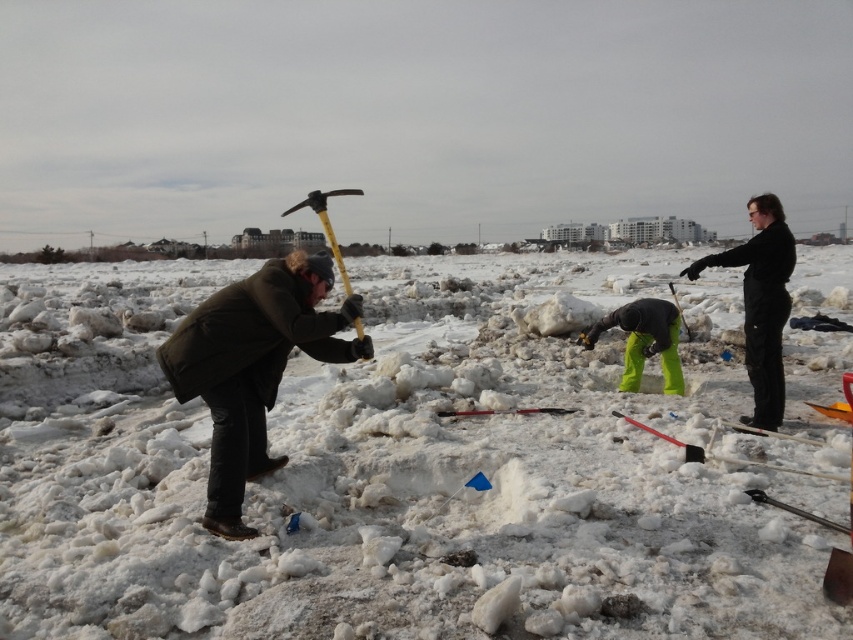
Question: Estimate the real-world distances between objects in this image. Which object is closer to the green fabric pants at center?

Choices:
 (A) black matte jacket at upper right
 (B) dark green jacket at left

Answer: (A)

Question: Does white fluffy snow at center have a lesser width compared to black matte jacket at upper right?

Choices:
 (A) yes
 (B) no

Answer: (B)

Question: In this image, where is dark green jacket at left located relative to green fabric pants at center?

Choices:
 (A) below
 (B) above

Answer: (A)

Question: Which point is closer to the camera taking this photo?

Choices:
 (A) click(627, 323)
 (B) click(782, 220)
 (C) click(216, 400)

Answer: (C)

Question: Which object is farther from the camera taking this photo?

Choices:
 (A) green fabric pants at center
 (B) smooth plastic shovel at center

Answer: (A)

Question: Can you confirm if white fluffy snow at center is thinner than black matte jacket at upper right?

Choices:
 (A) no
 (B) yes

Answer: (A)